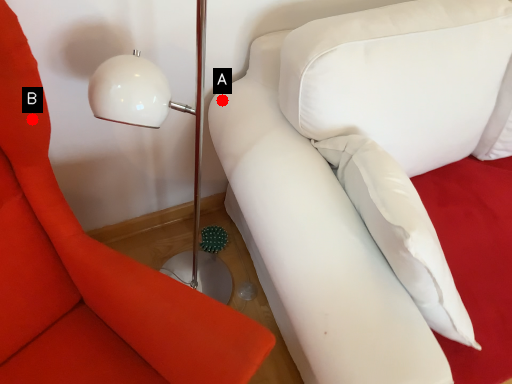
Question: Two points are circled on the image, labeled by A and B beside each circle. Which of the following is the farthest from the observer?

Choices:
 (A) A is further
 (B) B is further

Answer: (A)